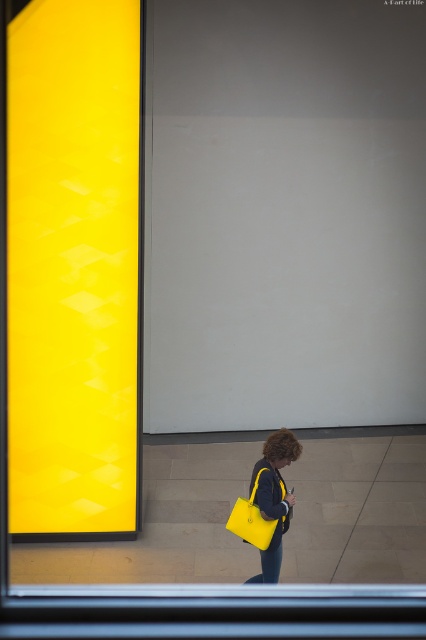
Question: Which point is farther from the camera taking this photo?

Choices:
 (A) (238, 529)
 (B) (253, 580)

Answer: (B)

Question: Is matte yellow handbag at lower center smaller than matte yellow shoulder bag at lower center?

Choices:
 (A) yes
 (B) no

Answer: (B)

Question: Among these points, which one is farthest from the camera?

Choices:
 (A) (241, 499)
 (B) (276, 525)

Answer: (A)

Question: Where is matte yellow handbag at lower center located in relation to matte yellow shoulder bag at lower center in the image?

Choices:
 (A) above
 (B) below

Answer: (B)

Question: Is matte yellow handbag at lower center below matte yellow shoulder bag at lower center?

Choices:
 (A) no
 (B) yes

Answer: (B)